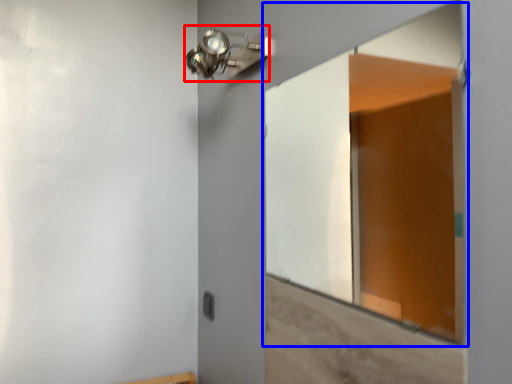
Question: Which object is closer to the camera taking this photo, light fixture (highlighted by a red box) or window (highlighted by a blue box)?

Choices:
 (A) light fixture
 (B) window

Answer: (B)